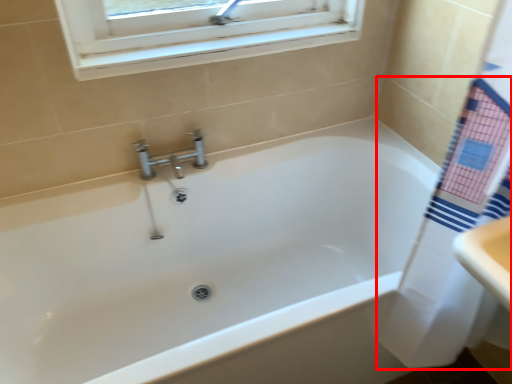
Question: From the image's perspective, where is bath towel (annotated by the red box) located in relation to bathtub in the image?

Choices:
 (A) below
 (B) above

Answer: (A)